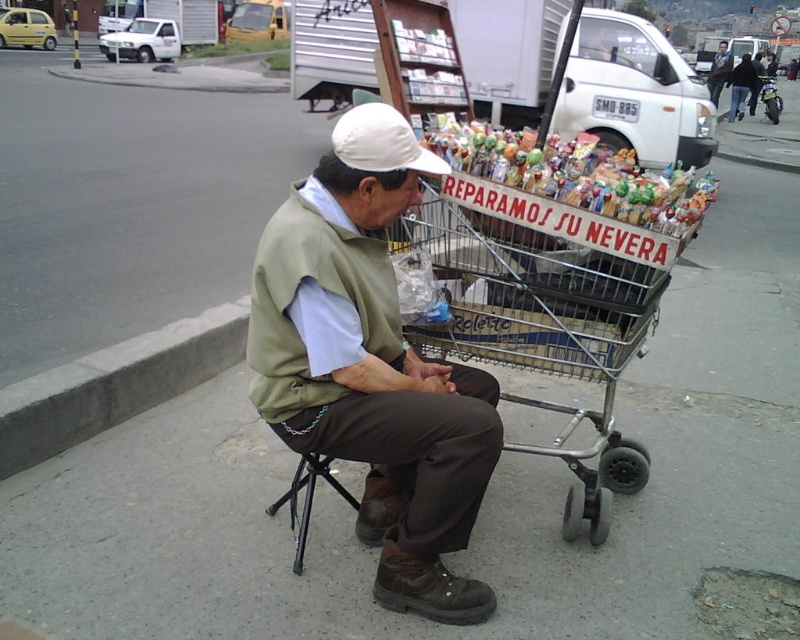
You are a delivery person who needs to place a package between the metallic silver shopping cart at center and the white fabric baseball cap at center. The package is 24 inches long. Can you fit it between them without moving either object?

The metallic silver shopping cart at center and the white fabric baseball cap at center are 26.79 inches apart. Since the package is 24 inches long, it can fit between them as the distance is slightly larger than the package length.

You are a delivery person who needs to place a large package in the space between the metallic silver shopping cart at center and the translucent plastic candy at center. Can you fit the package if it is 1 meter wide?

The metallic silver shopping cart at center might be wider than translucent plastic candy at center, but without knowing the exact width of the shopping cart, it is impossible to determine if the 1 meter wide package will fit between them.

Based on the scene description, where is the metallic silver shopping cart at center located in terms of its 2D coordinates?

The metallic silver shopping cart at center is located at the 2D coordinates of point (540, 328).